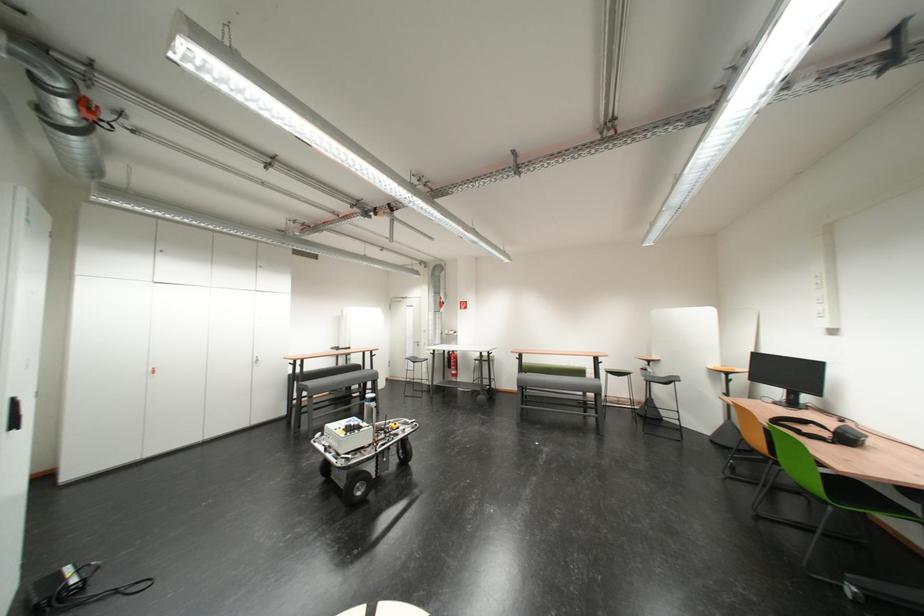
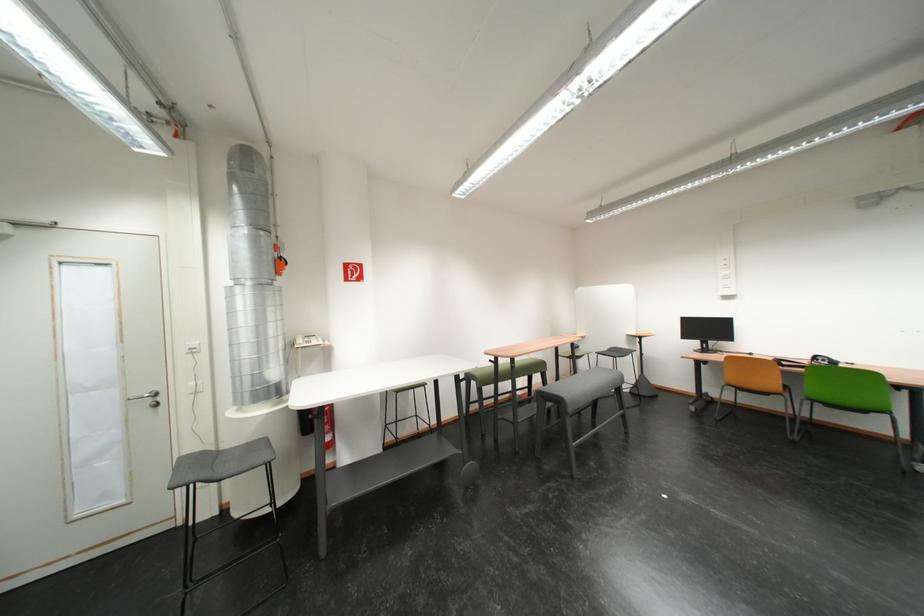
Where in the second image is the point corresponding to (x=450, y=306) from the first image?

(284, 265)